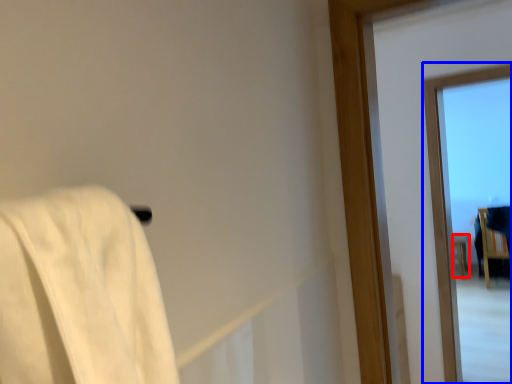
Question: Among these objects, which one is nearest to the camera, furniture (highlighted by a red box) or window (highlighted by a blue box)?

Choices:
 (A) furniture
 (B) window

Answer: (B)